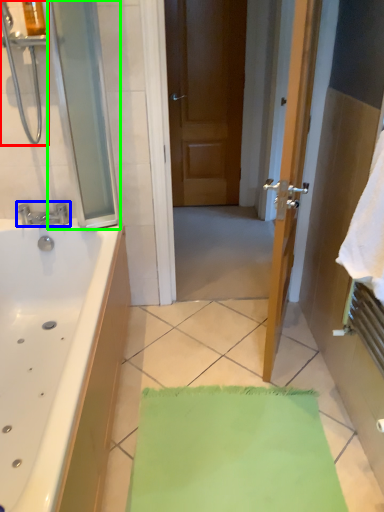
Question: Which is farther away from shower (highlighted by a red box)? tap (highlighted by a blue box) or screen door (highlighted by a green box)?

Choices:
 (A) tap
 (B) screen door

Answer: (A)